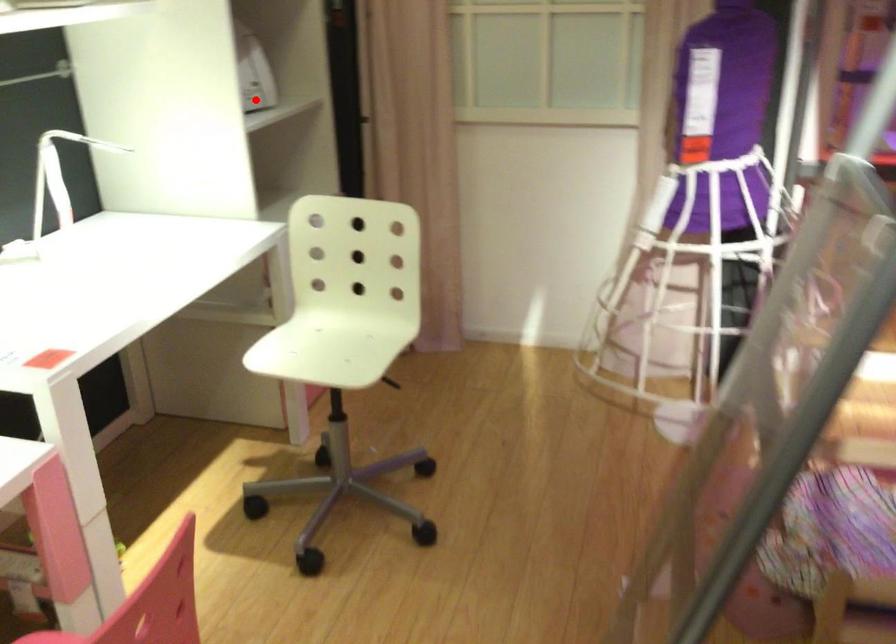
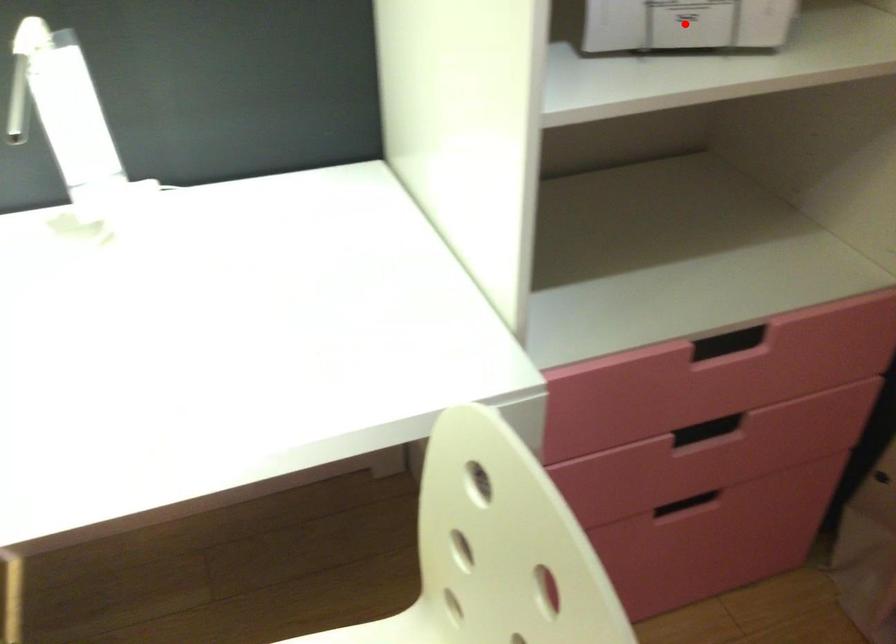
I am providing you with two images of the same scene from different viewpoints. A red point is marked on the first image and another point is marked on the second image. Do the highlighted points in image1 and image2 indicate the same real-world spot?

Yes